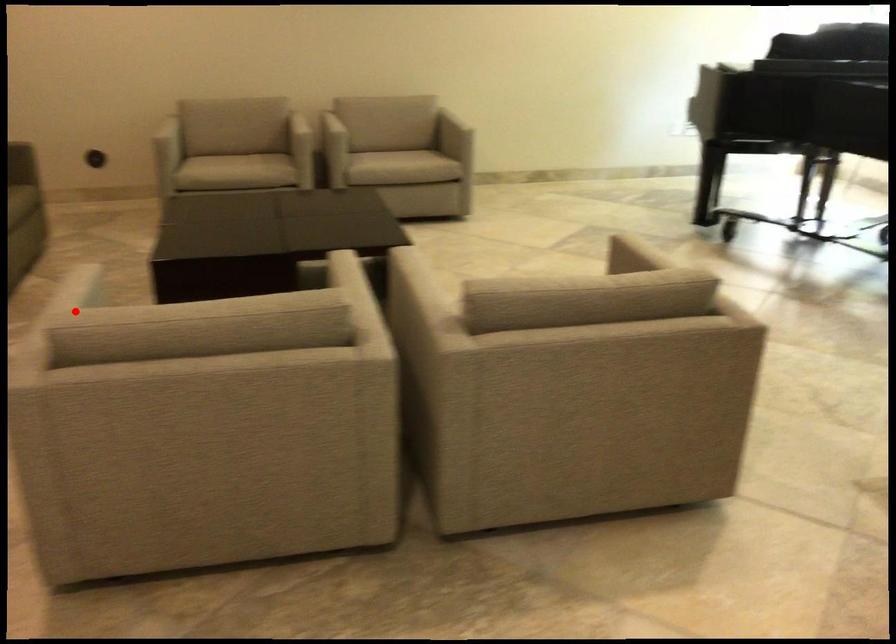
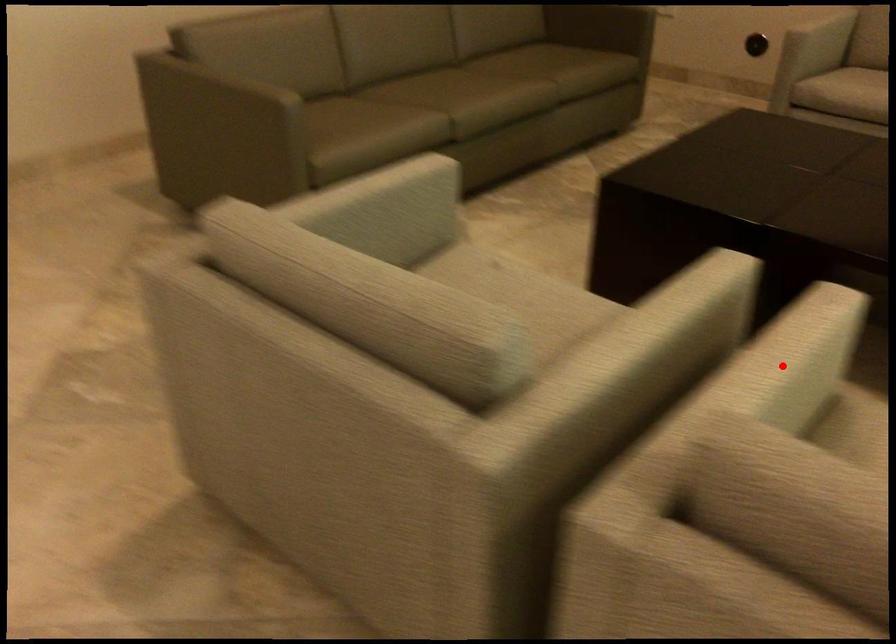
I am providing you with two images of the same scene from different viewpoints. A red point is marked on the first image and another point is marked on the second image. Is the marked point in image1 the same physical position as the marked point in image2?

No